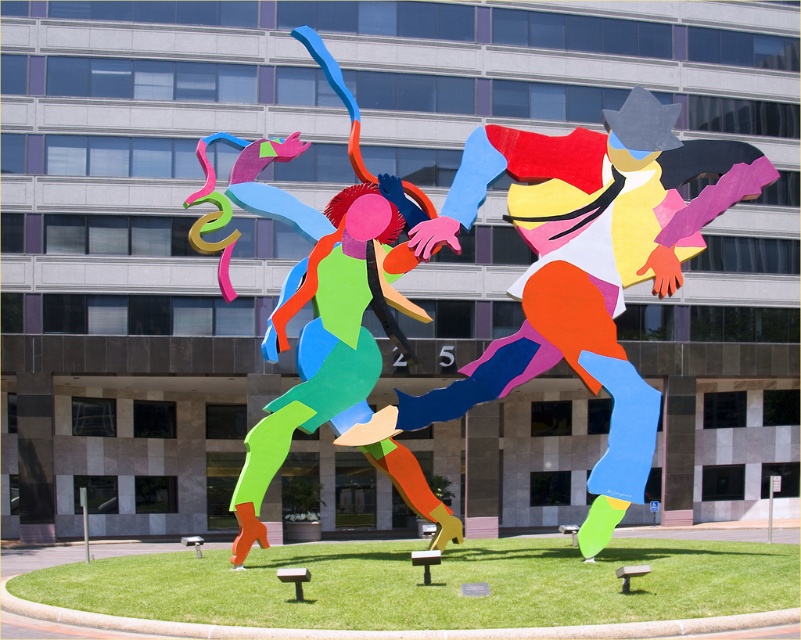
You are standing in front of the sculpture and want to place a new decorative item exactly at the midpoint between the two figures. Given the coordinates of the matte plastic figure at right, can you determine the coordinates of the other figure to ensure proper placement?

To find the midpoint between the two figures, you need the coordinates of both. Since the matte plastic figure at right is at point (590,268), you would need the coordinates of the other figure to calculate the midpoint. Without the other figure coordinates, the exact midpoint cannot be determined.

You are standing in front of the sculpture and want to touch both the matte plastic figure at right and the matte plastic sculpture at center. Which one can you reach first without moving your position?

The matte plastic figure at right is closer to the viewer than the matte plastic sculpture at center, so you can reach it first without moving.